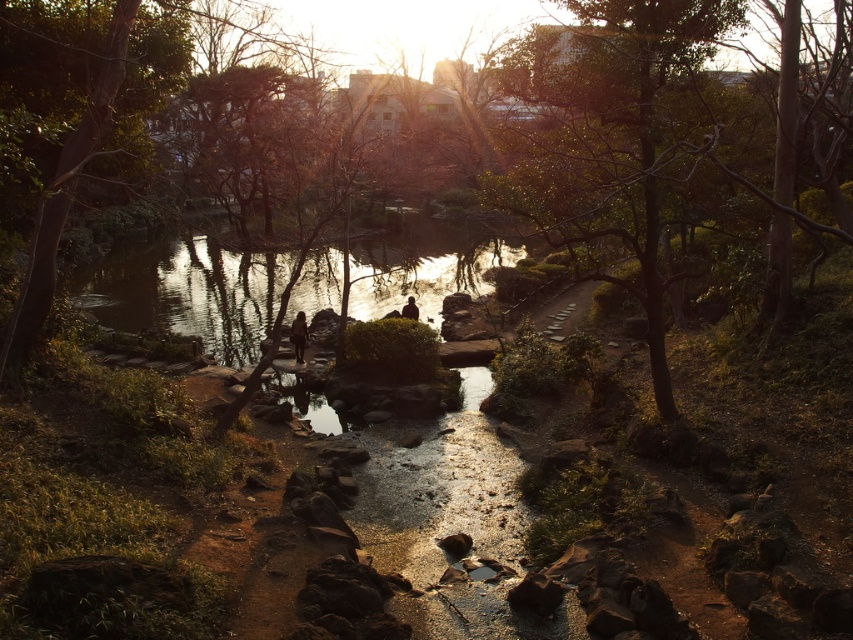
Question: Which point is closer to the camera taking this photo?

Choices:
 (A) coord(410,308)
 (B) coord(291,323)
 (C) coord(733,16)

Answer: (C)

Question: Is brown textured rock at center above silhouette figure at center?

Choices:
 (A) yes
 (B) no

Answer: (B)

Question: Is green leafy tree at upper center positioned before brown textured rock at center?

Choices:
 (A) yes
 (B) no

Answer: (A)

Question: Which object is positioned closest to the green leafy tree at upper center?

Choices:
 (A) brown textured rock at center
 (B) silhouette figure at center

Answer: (A)

Question: Is brown textured rock at center bigger than silhouette figure at center?

Choices:
 (A) yes
 (B) no

Answer: (A)

Question: Among these points, which one is nearest to the camera?

Choices:
 (A) (303, 349)
 (B) (404, 307)

Answer: (A)